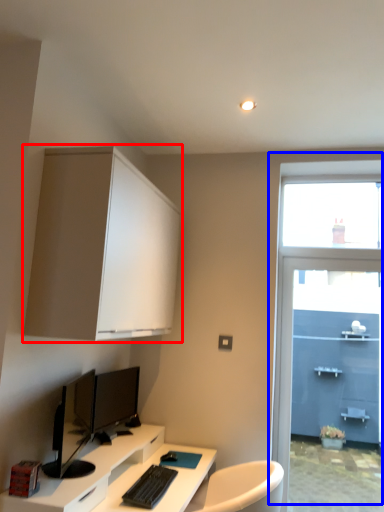
Question: Which object appears farthest to the camera in this image, cabinetry (highlighted by a red box) or window (highlighted by a blue box)?

Choices:
 (A) cabinetry
 (B) window

Answer: (B)